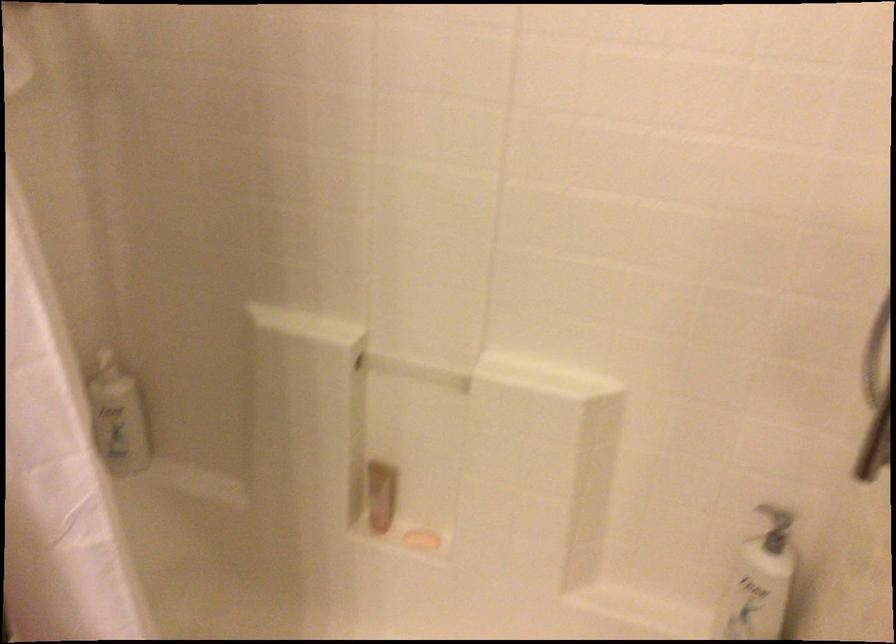
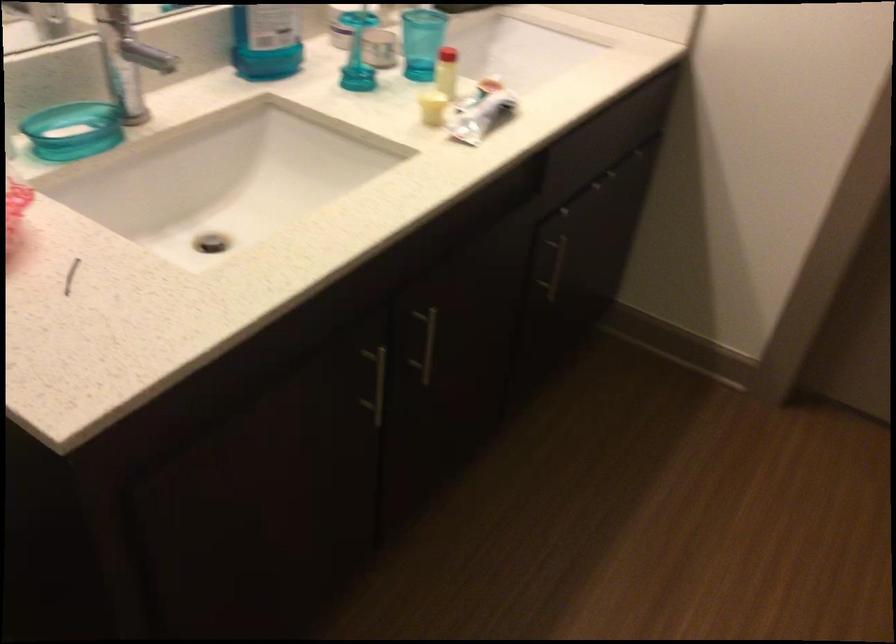
First-person continuous shooting, in which direction is the camera rotating?

The camera's rotation is toward left-down.